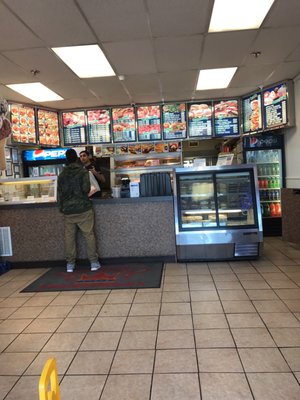
Where is `light cover`? light cover is located at coordinates (249, 7), (215, 77), (83, 67), (40, 90).